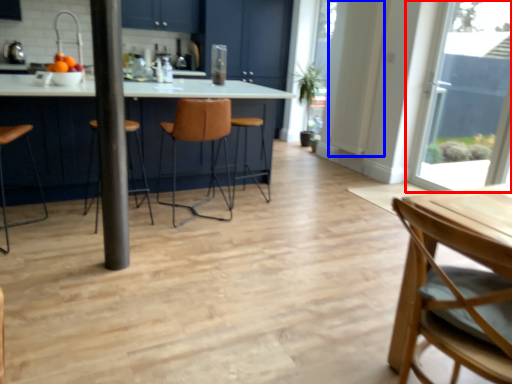
Question: Which object appears farthest to the camera in this image, window (highlighted by a red box) or door (highlighted by a blue box)?

Choices:
 (A) window
 (B) door

Answer: (B)